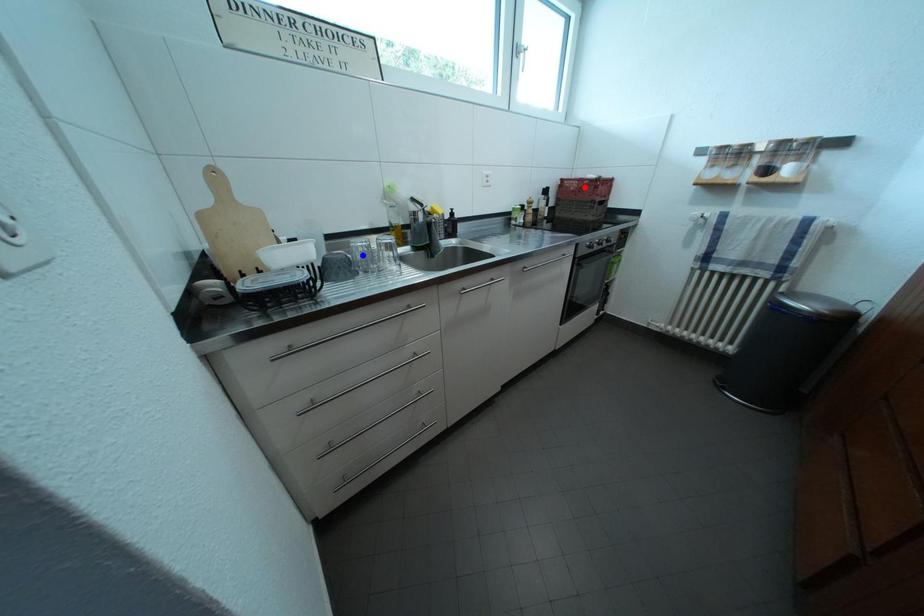
Question: Which of the two points in the image is closer to the camera?

Choices:
 (A) Blue point is closer.
 (B) Red point is closer.

Answer: (A)